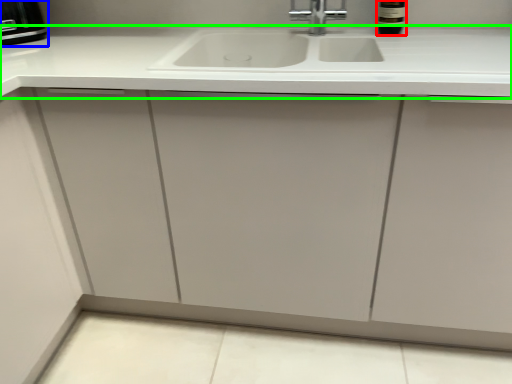
Question: Estimate the real-world distances between objects in this image. Which object is closer to wine bottle (highlighted by a red box), appliance (highlighted by a blue box) or countertop (highlighted by a green box)?

Choices:
 (A) appliance
 (B) countertop

Answer: (B)